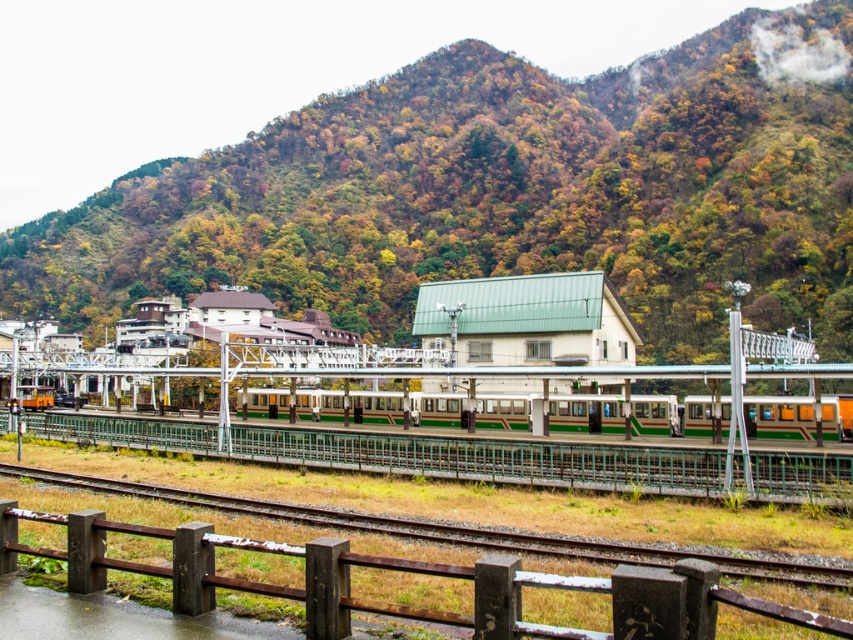
You are standing at the edge of the railway tracks in the image and want to walk towards the brown wooden fence at lower center. What direction should you move in to reach it?

Since the brown wooden fence at lower center is located at point 0.894 on the x and 0.477 on the y axis, you should move towards the lower center direction to reach it.